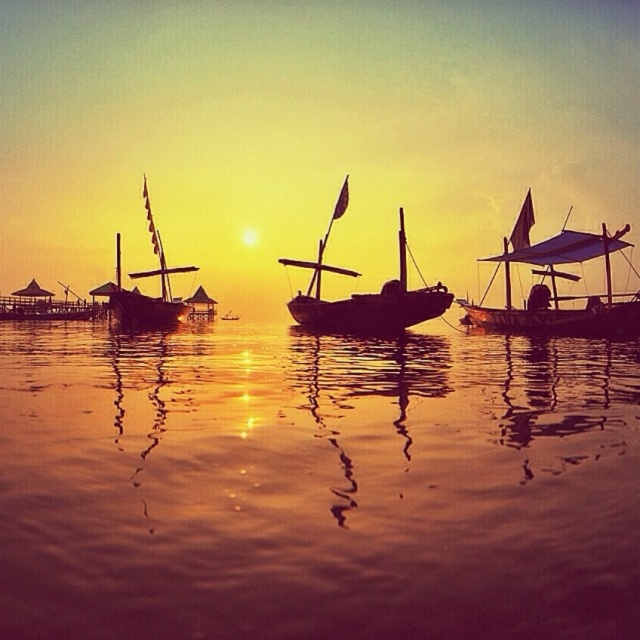
You are standing on the dock and looking at the sunset scene. There are two points marked in the image. Which point, point (145, 314) or point (52, 314), is closer to you?

Point (145, 314) is closer to the camera than point (52, 314).

You are standing on the dock and want to know where the shiny golden water at center is located in the image. Can you describe its position using the coordinate system provided?

The shiny golden water at center is located at point 0.759 on the horizontal axis and 0.495 on the vertical axis according to the coordinate system provided.

You are standing at the center of the image looking towards the horizon. Which direction should you turn to face the wooden sailboat at left?

Since the wooden sailboat at left is located at point coordinates, turning to the left would orient you towards its position relative to your central viewpoint.